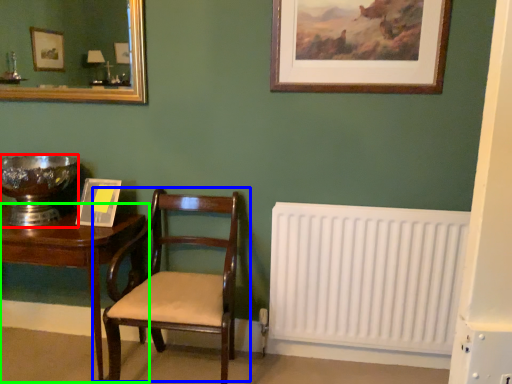
Question: Which object is positioned closest to glass bowl (highlighted by a red box)? Select from chair (highlighted by a blue box) and table (highlighted by a green box).

Choices:
 (A) chair
 (B) table

Answer: (B)